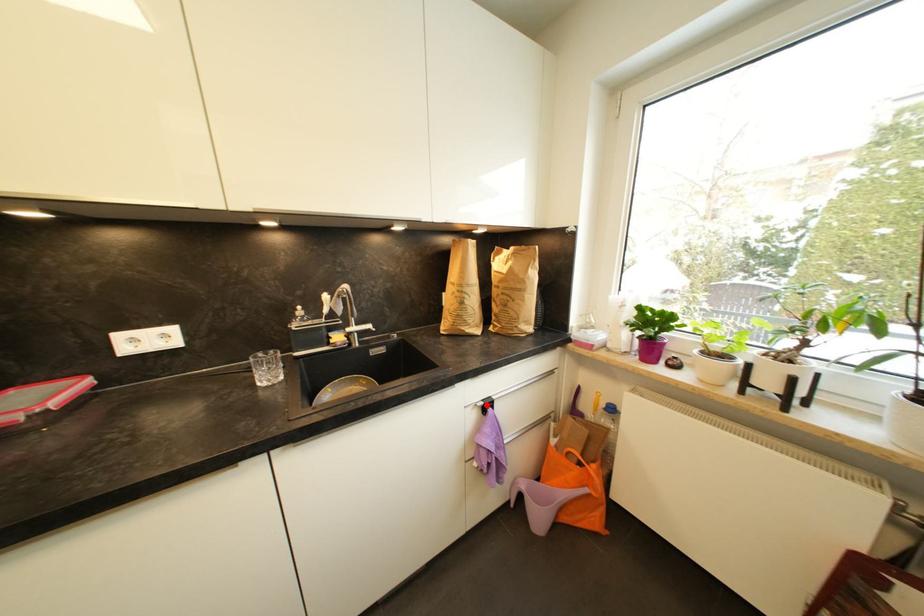
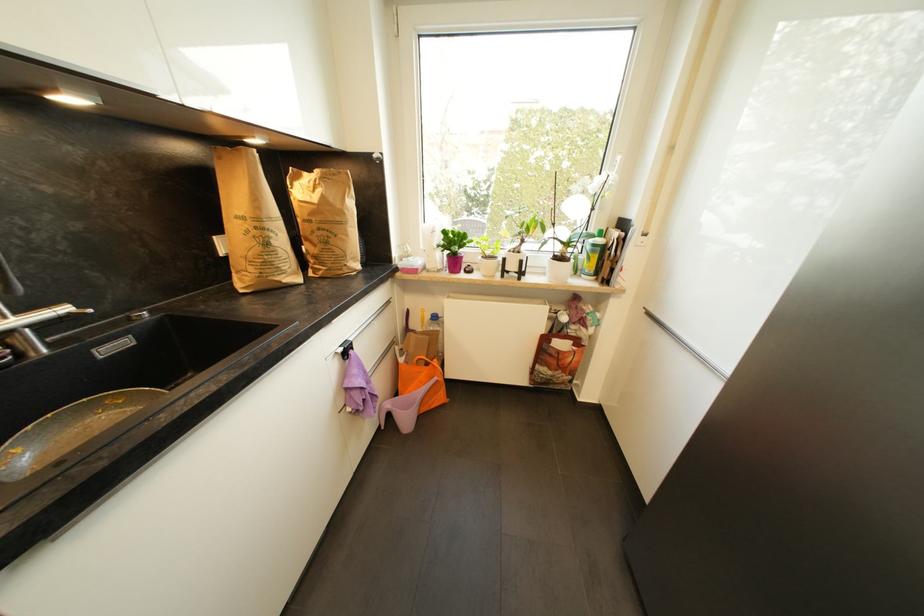
Question: I am providing you with two images of the same scene from different viewpoints. Given a red point in image1, look at the same physical point in image2. Is it:

Choices:
 (A) Closer to the viewpoint
 (B) Farther from the viewpoint

Answer: (A)